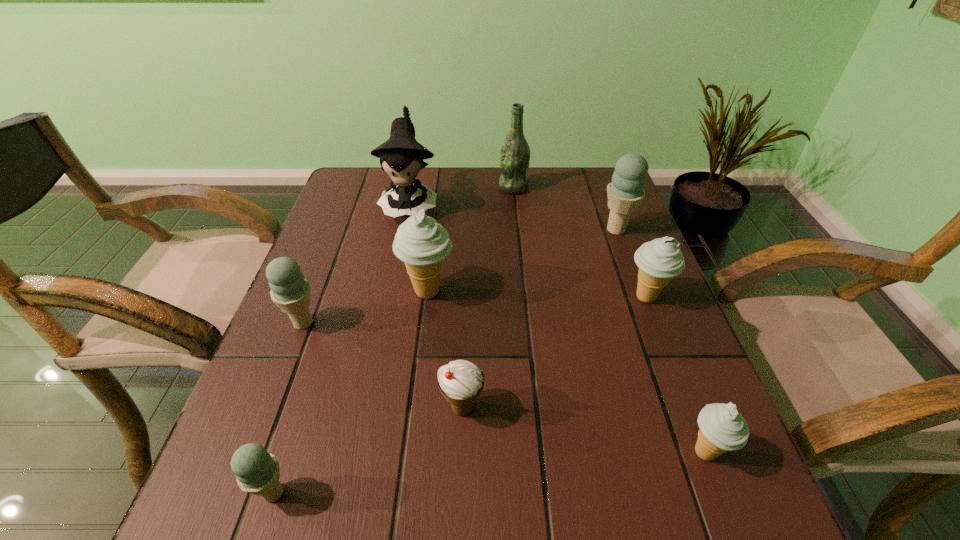
The image size is (960, 540). Find the location of `doll`. doll is located at coordinates (401, 156).

Locate an element on the screen. The height and width of the screenshot is (540, 960). the sixth object from left to right is located at coordinates (515, 153).

The height and width of the screenshot is (540, 960). Identify the location of beer bottle. (515, 153).

Where is `the rightmost blue ice cream`? the rightmost blue ice cream is located at coordinates (625, 193).

The image size is (960, 540). I want to click on the biggest blue ice cream, so click(625, 193).

Where is `the leftmost beige icecream`? the leftmost beige icecream is located at coordinates (421, 243).

Image resolution: width=960 pixels, height=540 pixels. Find the location of `the second biggest beige icecream`. the second biggest beige icecream is located at coordinates (658, 260).

You are a GUI agent. You are given a task and a screenshot of the screen. Output one action in this format:
    pyautogui.click(x=<x>, y=<y>)
    Task: Click on the second smallest blue ice cream
    This screenshot has height=540, width=960.
    Given the screenshot: What is the action you would take?
    290,291

Locate an element on the screen. the seventh farthest object is located at coordinates (461, 382).

Identify the location of white icecream. (461, 382).